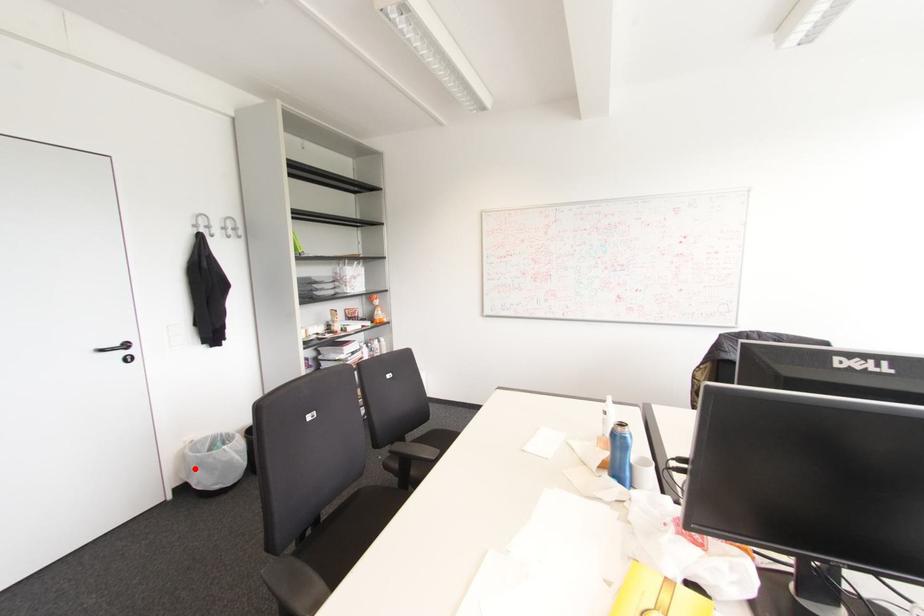
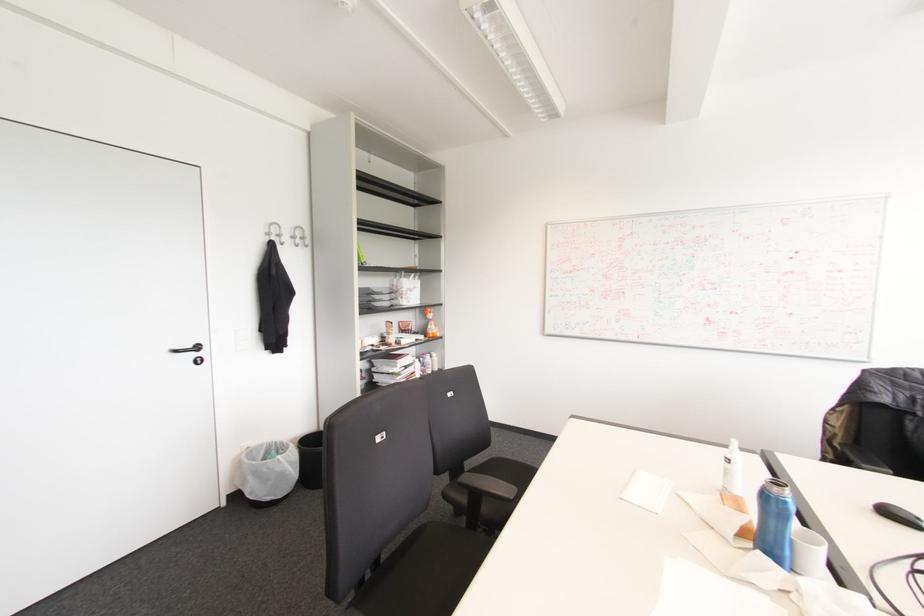
Question: I am providing you with two images of the same scene from different viewpoints. Image1 has a red point marked. In image2, the corresponding 3D location appears at what relative position? Reply with the corresponding letter.

Choices:
 (A) Closer
 (B) Farther

Answer: (B)